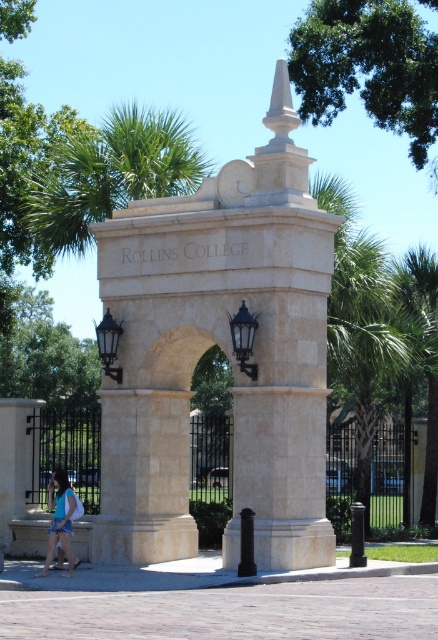
Question: Which point appears farthest from the camera in this image?

Choices:
 (A) (103, 420)
 (B) (430, 72)

Answer: (B)

Question: Is green leafy tree at upper center in front of green leafy palm tree at upper left?

Choices:
 (A) no
 (B) yes

Answer: (A)

Question: Can you confirm if green leafy tree at upper center is wider than green leafy palm tree at upper left?

Choices:
 (A) no
 (B) yes

Answer: (B)

Question: Is green leafy palm tree at upper left below blue denim shorts at lower left?

Choices:
 (A) yes
 (B) no

Answer: (B)

Question: Among these objects, which one is nearest to the camera?

Choices:
 (A) green leafy tree at upper center
 (B) blue denim shorts at lower left

Answer: (B)

Question: Which of the following is the closest to the observer?

Choices:
 (A) beige stone arch at center
 (B) blue denim shorts at lower left

Answer: (B)